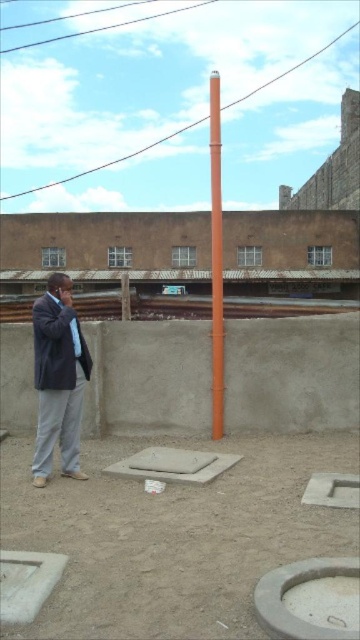
Question: Is dark gray suit at left wider than gray concrete manhole at center?

Choices:
 (A) no
 (B) yes

Answer: (B)

Question: Which of these objects is positioned closest to the concrete at lower right?

Choices:
 (A) orange matte pole at center
 (B) gray concrete manhole at center
 (C) dark gray suit at left

Answer: (B)

Question: In this image, where is dark gray suit at left located relative to gray concrete manhole at center?

Choices:
 (A) left
 (B) right

Answer: (A)

Question: Does concrete at lower right appear on the left side of orange matte pole at center?

Choices:
 (A) no
 (B) yes

Answer: (B)

Question: Which of these objects is positioned closest to the dark gray suit at left?

Choices:
 (A) concrete at lower right
 (B) orange matte pole at center

Answer: (A)

Question: Which point appears closest to the camera in this image?

Choices:
 (A) (54, 340)
 (B) (210, 205)
 (C) (201, 467)
 (D) (306, 573)

Answer: (D)